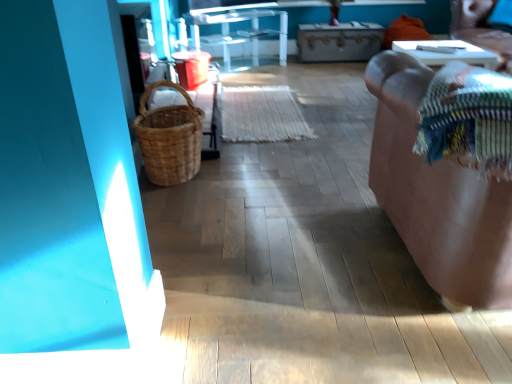
Question: Is multicolored woven blanket at right inside wooden drawer at center?

Choices:
 (A) yes
 (B) no

Answer: (B)

Question: Is wooden drawer at center oriented towards multicolored woven blanket at right?

Choices:
 (A) yes
 (B) no

Answer: (A)

Question: From the image's perspective, is wooden drawer at center over multicolored woven blanket at right?

Choices:
 (A) no
 (B) yes

Answer: (B)

Question: Considering the relative sizes of wooden drawer at center and multicolored woven blanket at right in the image provided, is wooden drawer at center shorter than multicolored woven blanket at right?

Choices:
 (A) yes
 (B) no

Answer: (B)

Question: From a real-world perspective, is wooden drawer at center located higher than multicolored woven blanket at right?

Choices:
 (A) yes
 (B) no

Answer: (B)

Question: Can you confirm if wooden drawer at center is smaller than multicolored woven blanket at right?

Choices:
 (A) no
 (B) yes

Answer: (A)

Question: Is multicolored woven blanket at right positioned behind transparent glass table at center, which is the 2th furniture in right-to-left order?

Choices:
 (A) yes
 (B) no

Answer: (B)

Question: Is multicolored woven blanket at right turned away from transparent glass table at center, the 2th furniture when ordered from bottom to top?

Choices:
 (A) yes
 (B) no

Answer: (B)

Question: Can you confirm if multicolored woven blanket at right is taller than transparent glass table at center, which is the 2th furniture in right-to-left order?

Choices:
 (A) yes
 (B) no

Answer: (B)

Question: Does multicolored woven blanket at right come in front of transparent glass table at center, the first furniture viewed from the left?

Choices:
 (A) no
 (B) yes

Answer: (B)

Question: Considering the relative positions of multicolored woven blanket at right and transparent glass table at center, the 2th furniture in the front-to-back sequence, in the image provided, is multicolored woven blanket at right to the right of transparent glass table at center, the 2th furniture in the front-to-back sequence, from the viewer's perspective?

Choices:
 (A) yes
 (B) no

Answer: (A)

Question: Is multicolored woven blanket at right completely or partially outside of transparent glass table at center, the 2th furniture in the front-to-back sequence?

Choices:
 (A) yes
 (B) no

Answer: (A)

Question: Is brown woven basket at upper right wider than wooden drawer at center?

Choices:
 (A) no
 (B) yes

Answer: (A)